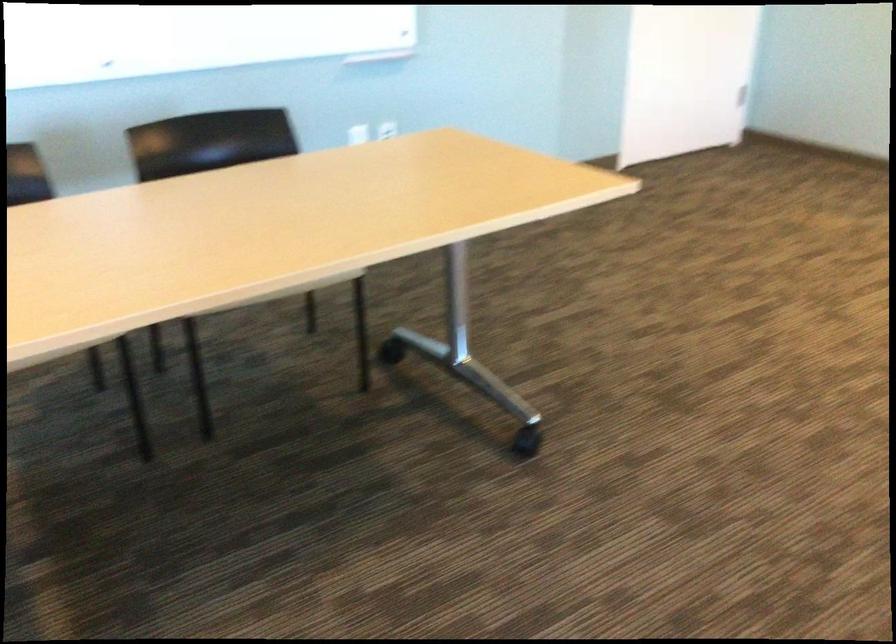
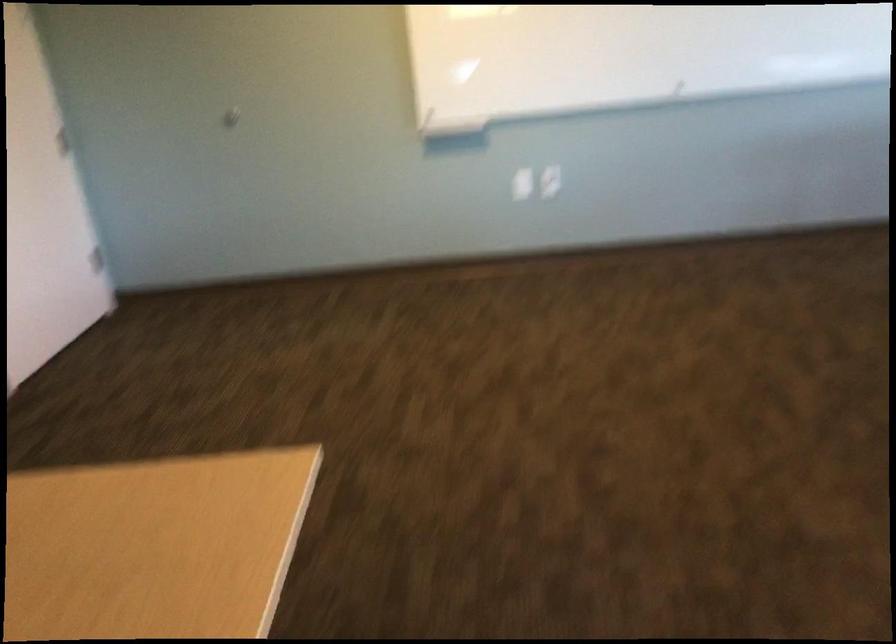
Question: The camera is either moving clockwise (left) or counter-clockwise (right) around the object. The first image is from the beginning of the video and the second image is from the end. Is the camera moving left or right when shooting the video?

Choices:
 (A) Left
 (B) Right

Answer: (A)